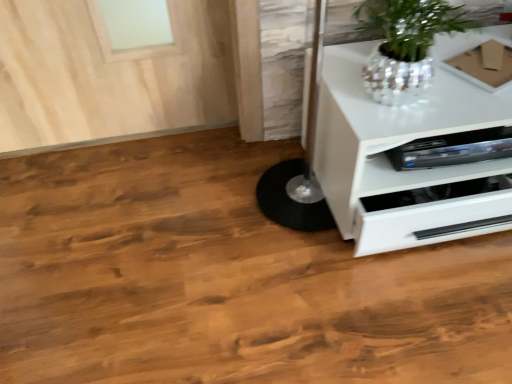
At what (x,y) coordinates should I click in order to perform the action: click on vacant area located to the right-hand side of shiny metallic pot at upper right. Please return your answer as a coordinate pair (x, y). The width and height of the screenshot is (512, 384). Looking at the image, I should click on (468, 91).